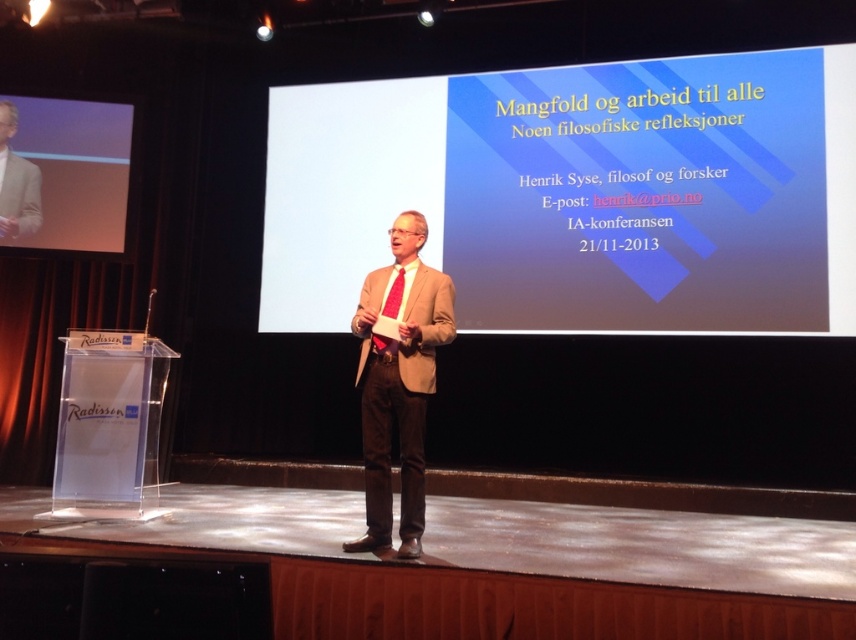
What is the spatial relationship between the matte brown suit at center and the light brown suit at left in the image?

The matte brown suit at center is located below the light brown suit at left.

You are an event planner who needs to ensure that the speaker is visible to the audience. The podium on the left has a height of 4 feet. The speaker is standing at the center of the stage. Considering the distance between the matte brown suit at center and the matte red tie at center, will the speaker be able to lean forward comfortably while speaking without hitting his head on the podium?

The distance between the matte brown suit at center and the matte red tie at center is 10.55 inches. Since the podium is 4 feet tall, the speaker can comfortably lean forward without hitting his head as the vertical distance from his suit to tie is much smaller than the podium height.

You are an event planner organizing a formal conference. You have two suits available for the keynote speaker to choose from. The matte brown suit at center and the light brown suit at left. The speaker prefers a suit that is taller in appearance. Which suit should they choose?

The matte brown suit at center has a greater height compared to the light brown suit at left, so the speaker should choose the matte brown suit at center for a taller appearance.